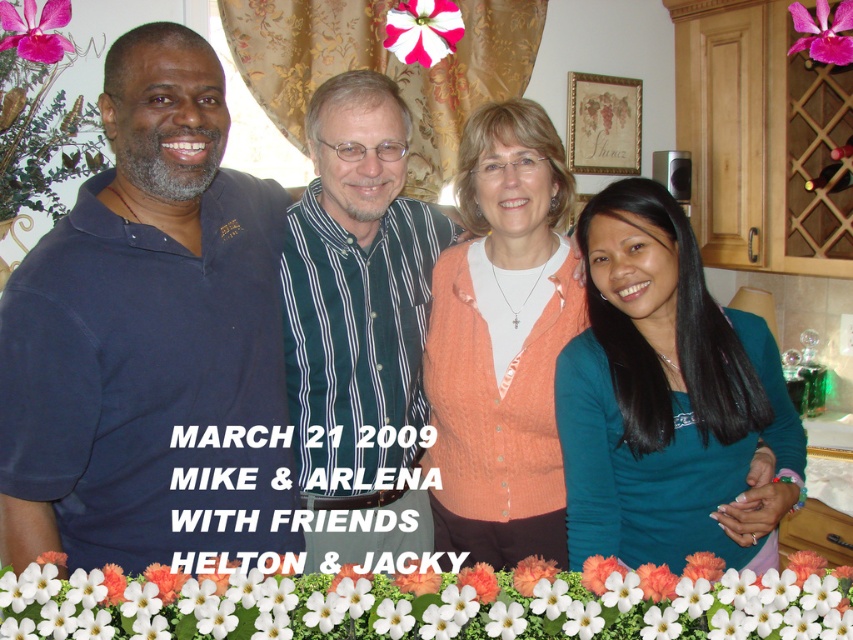
Question: Does green striped shirt at center come in front of orange knitted cardigan at center?

Choices:
 (A) no
 (B) yes

Answer: (B)

Question: Estimate the real-world distances between objects in this image. Which object is closer to the white matte flower at upper center?

Choices:
 (A) orange knitted cardigan at center
 (B) purple silk flower at upper left
 (C) green striped shirt at center
 (D) teal matte shirt at center

Answer: (A)

Question: Among these points, which one is farthest from the camera?

Choices:
 (A) (53, 26)
 (B) (352, 218)

Answer: (B)

Question: Can you confirm if teal matte shirt at center is thinner than white matte flower at lower center?

Choices:
 (A) yes
 (B) no

Answer: (A)

Question: Which of the following is the closest to the observer?

Choices:
 (A) (335, 230)
 (B) (216, 433)

Answer: (B)

Question: In this image, where is green striped shirt at center located relative to orange knitted cardigan at center?

Choices:
 (A) left
 (B) right

Answer: (A)